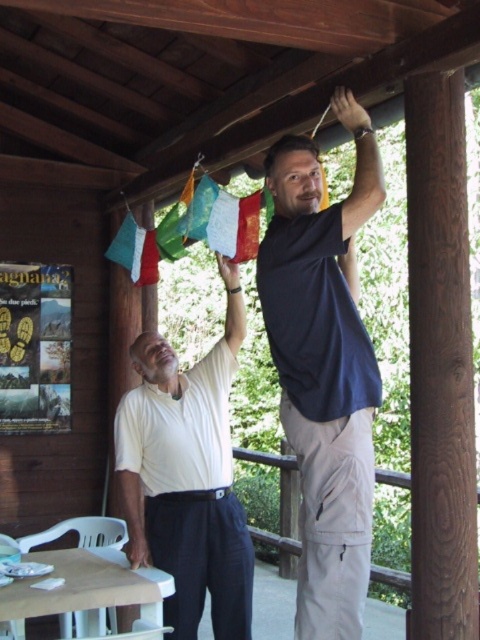
Does point (291, 243) come closer to viewer compared to point (220, 497)?

Yes, it is in front of point (220, 497).

Which is in front, point (356, 173) or point (193, 499)?

Point (356, 173) is in front.

Find the location of a particular element. This screenshot has height=640, width=480. dark blue t-shirt at upper center is located at coordinates (324, 368).

The width and height of the screenshot is (480, 640). I want to click on dark blue t-shirt at upper center, so click(x=324, y=368).